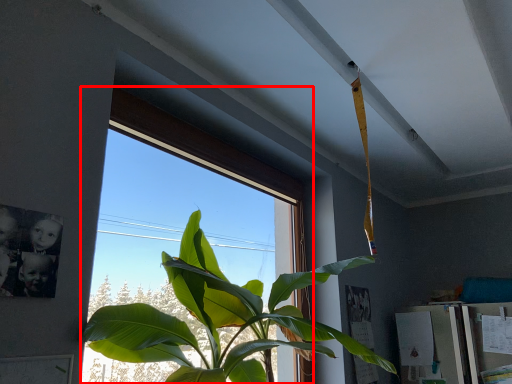
Question: From the image's perspective, where is window (annotated by the red box) located in relation to houseplant in the image?

Choices:
 (A) below
 (B) above

Answer: (B)